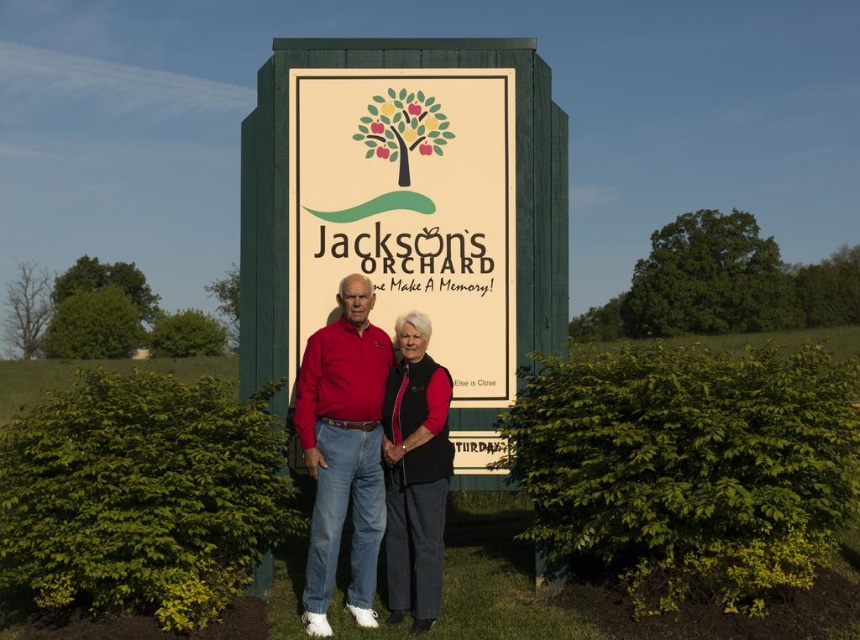
Question: Does matte green sign at center appear on the right side of matte red shirt at center?

Choices:
 (A) yes
 (B) no

Answer: (A)

Question: Which of these objects is positioned closest to the matte green sign at center?

Choices:
 (A) matte red shirt at center
 (B) velvet black vest at center

Answer: (B)

Question: Does matte green sign at center appear on the left side of matte red shirt at center?

Choices:
 (A) yes
 (B) no

Answer: (B)

Question: Which object is the closest to the velvet black vest at center?

Choices:
 (A) matte red shirt at center
 (B) matte green sign at center

Answer: (A)

Question: Which of the following is the closest to the observer?

Choices:
 (A) velvet black vest at center
 (B) matte green sign at center

Answer: (A)

Question: Is matte red shirt at center smaller than velvet black vest at center?

Choices:
 (A) yes
 (B) no

Answer: (B)